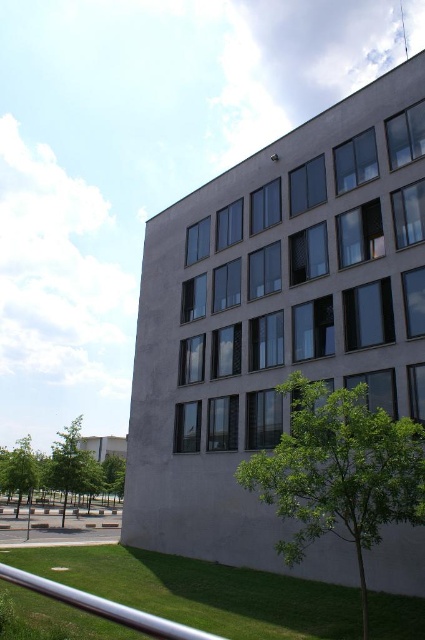
You are standing in front of a modern building with a minimalist design. You notice green grass at lower left and a green leafy tree at center. Which object is closer to the left edge of the image?

The green grass at lower left is closer to the left edge of the image because it is positioned to the left of the green leafy tree at center.

You are standing in front of the modern building and want to walk towards the green leafy tree at center. Which direction should you move relative to the green grass at lower left?

To reach the green leafy tree at center from the green grass at lower left, you should move towards the center of the image, which is to the right and upwards from the green grass at lower left.

You are standing at the center of the image and looking towards the building. Which direction should you turn to face the green grass at lower left?

The green grass at lower left is located at point (201,592), so you should turn to your left to face it.